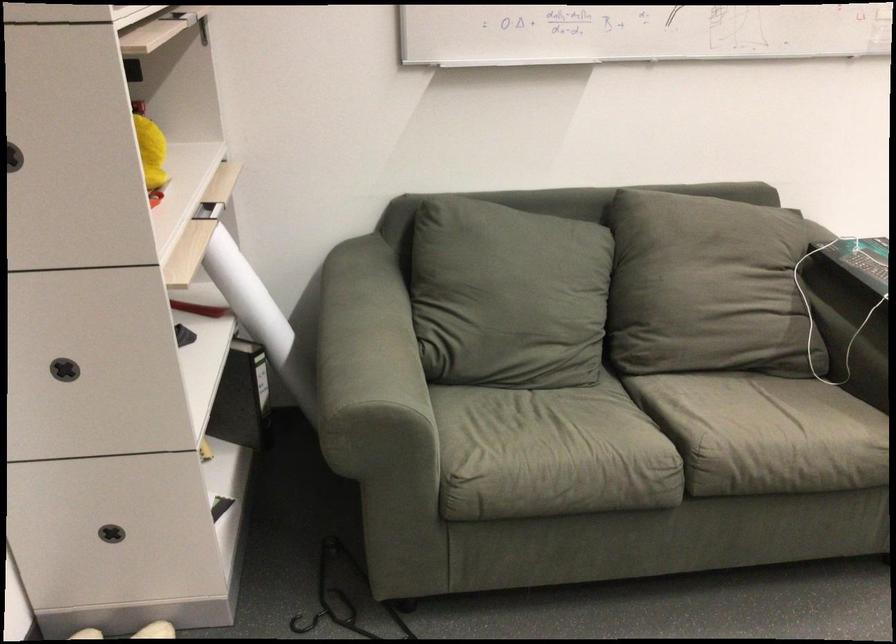
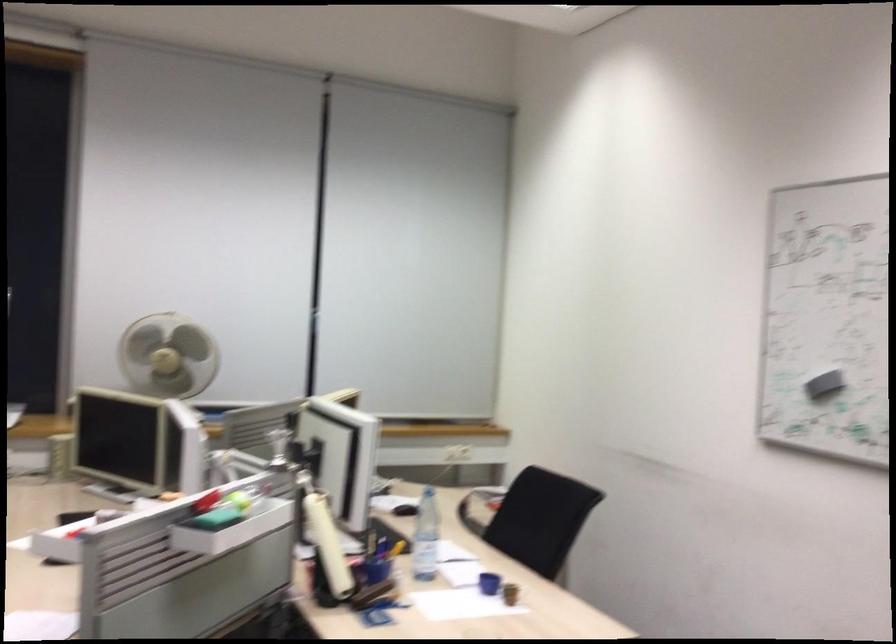
Question: The camera is either moving clockwise (left) or counter-clockwise (right) around the object. The first image is from the beginning of the video and the second image is from the end. Is the camera moving left or right when shooting the video?

Choices:
 (A) Left
 (B) Right

Answer: (A)